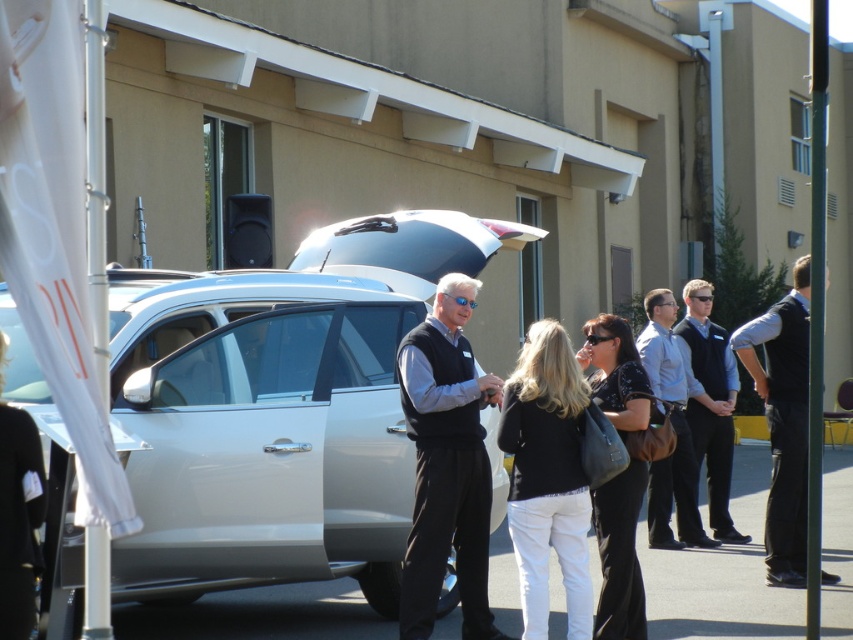
Question: Among these points, which one is nearest to the camera?

Choices:
 (A) (20, 417)
 (B) (782, 385)

Answer: (A)

Question: Which is nearer to the black fabric coat at center?

Choices:
 (A) black vest at center
 (B) light gray shirt at center
 (C) satin silver car at center
 (D) black matte sweater at center

Answer: (D)

Question: Can you confirm if black matte sweater at center is bigger than black vest at center?

Choices:
 (A) no
 (B) yes

Answer: (A)

Question: Is black matte sweater at center to the right of dark blue vest at center from the viewer's perspective?

Choices:
 (A) no
 (B) yes

Answer: (A)

Question: Which point is closer to the camera?

Choices:
 (A) black vest at center
 (B) black leather handbag at center

Answer: (B)

Question: Can you confirm if satin silver car at center is wider than black fabric coat at center?

Choices:
 (A) no
 (B) yes

Answer: (B)